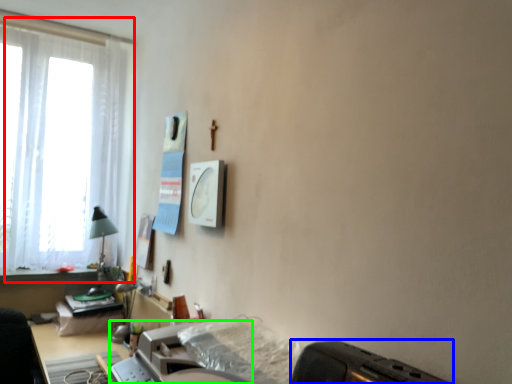
Question: Which is farther away from window (highlighted by a red box)? appliance (highlighted by a blue box) or printer (highlighted by a green box)?

Choices:
 (A) appliance
 (B) printer

Answer: (A)